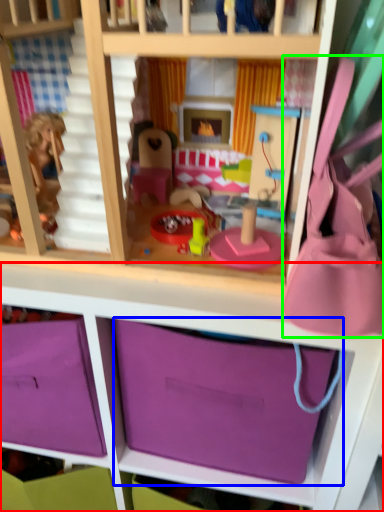
Question: Based on their relative distances, which object is nearer to shelf (highlighted by a red box)? Choose from storage box (highlighted by a blue box) and accessory (highlighted by a green box).

Choices:
 (A) storage box
 (B) accessory

Answer: (A)